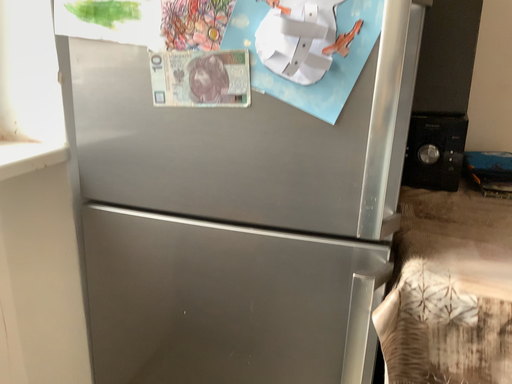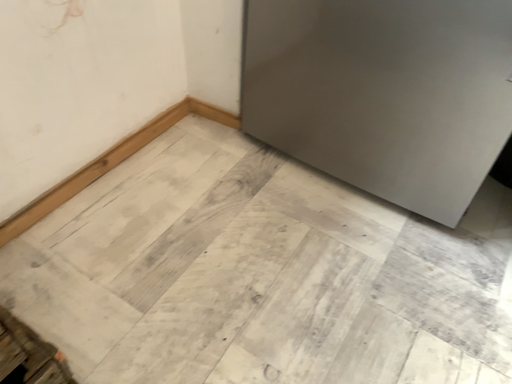
Question: How did the camera likely rotate when shooting the video?

Choices:
 (A) rotated right
 (B) rotated left

Answer: (B)